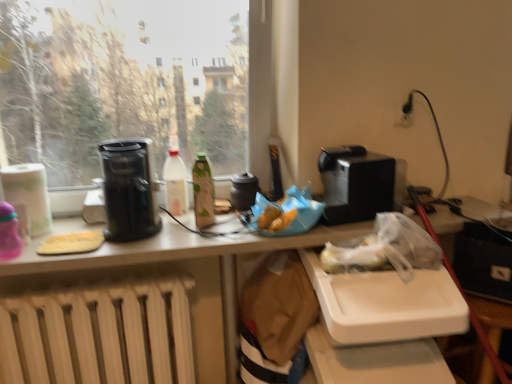
Where is `green matte bottle at center, marked as the 1th bottle in a right-to-left arrangement`? This screenshot has height=384, width=512. green matte bottle at center, marked as the 1th bottle in a right-to-left arrangement is located at coordinates (203, 192).

The height and width of the screenshot is (384, 512). Describe the element at coordinates (129, 189) in the screenshot. I see `black plastic coffee maker at left` at that location.

Image resolution: width=512 pixels, height=384 pixels. What do you see at coordinates (123, 83) in the screenshot? I see `transparent glass window at upper left` at bounding box center [123, 83].

Measure the distance between matte black kettle at center, which is counted as the first appliance, starting from the left, and camera.

matte black kettle at center, which is counted as the first appliance, starting from the left, is 1.59 meters from camera.

The image size is (512, 384). Identify the location of matte black kettle at center, the 2th appliance positioned from the right. (244, 191).

You are a GUI agent. You are given a task and a screenshot of the screen. Output one action in this format:
    pyautogui.click(x=<x>, y=<y>)
    Task: Click on the white matte radiator at lower left
    This screenshot has width=512, height=384.
    Given the screenshot: What is the action you would take?
    pyautogui.click(x=100, y=335)

Where is `yellow sponge at left`? yellow sponge at left is located at coordinates (72, 243).

Who is taller, white matte bottle at center, acting as the 1th bottle starting from the left, or black plastic toaster at upper right, the 1th appliance from the right?

Standing taller between the two is white matte bottle at center, acting as the 1th bottle starting from the left.

From the image's perspective, between white matte bottle at center, arranged as the 2th bottle when viewed from the right, and black plastic toaster at upper right, the 1th appliance from the right, which one is located above?

black plastic toaster at upper right, the 1th appliance from the right, is shown above in the image.

Is white matte bottle at center, acting as the 1th bottle starting from the left, oriented away from black plastic toaster at upper right, which appears as the second appliance when viewed from the left?

No, black plastic toaster at upper right, which appears as the second appliance when viewed from the left, is not at the back of white matte bottle at center, acting as the 1th bottle starting from the left.

How different are the orientations of white matte bottle at center, arranged as the 2th bottle when viewed from the right, and black plastic toaster at upper right, which appears as the second appliance when viewed from the left, in degrees?

0.345 degrees separate the facing orientations of white matte bottle at center, arranged as the 2th bottle when viewed from the right, and black plastic toaster at upper right, which appears as the second appliance when viewed from the left.

Is point (351, 199) closer or farther from the camera than point (178, 178)?

Point (351, 199).

Can you confirm if black plastic toaster at upper right, which appears as the second appliance when viewed from the left, is thinner than white matte bottle at center, acting as the 1th bottle starting from the left?

Incorrect, the width of black plastic toaster at upper right, which appears as the second appliance when viewed from the left, is not less than that of white matte bottle at center, acting as the 1th bottle starting from the left.

Does black plastic toaster at upper right, which appears as the second appliance when viewed from the left, have a lesser height compared to white matte bottle at center, arranged as the 2th bottle when viewed from the right?

Yes, black plastic toaster at upper right, which appears as the second appliance when viewed from the left, is shorter than white matte bottle at center, arranged as the 2th bottle when viewed from the right.

Between matte black kettle at center, the 2th appliance positioned from the right, and yellow sponge at left, which one has larger size?

matte black kettle at center, the 2th appliance positioned from the right.

From a real-world perspective, is matte black kettle at center, the 2th appliance positioned from the right, physically located above or below yellow sponge at left?

Clearly, from a real-world perspective, matte black kettle at center, the 2th appliance positioned from the right, is above yellow sponge at left.

Considering the sizes of matte black kettle at center, which is counted as the first appliance, starting from the left, and yellow sponge at left in the image, is matte black kettle at center, which is counted as the first appliance, starting from the left, taller or shorter than yellow sponge at left?

matte black kettle at center, which is counted as the first appliance, starting from the left, is taller than yellow sponge at left.

Could you tell me if matte black kettle at center, the 2th appliance positioned from the right, is facing white matte radiator at lower left?

No, matte black kettle at center, the 2th appliance positioned from the right, is not oriented towards white matte radiator at lower left.

Which is more to the left, matte black kettle at center, the 2th appliance positioned from the right, or white matte radiator at lower left?

From the viewer's perspective, white matte radiator at lower left appears more on the left side.

Is there a large distance between matte black kettle at center, which is counted as the first appliance, starting from the left, and white matte radiator at lower left?

No, there isn't a large distance between matte black kettle at center, which is counted as the first appliance, starting from the left, and white matte radiator at lower left.

Is white matte radiator at lower left aimed at yellow sponge at left?

No, white matte radiator at lower left is not turned towards yellow sponge at left.

Considering the points (27, 355) and (61, 236), which point is behind, point (27, 355) or point (61, 236)?

Positioned behind is point (27, 355).

Can you tell me how much white matte radiator at lower left and yellow sponge at left differ in facing direction?

The facing directions of white matte radiator at lower left and yellow sponge at left are 2.18 degrees apart.

How different are the orientations of white matte bottle at center, arranged as the 2th bottle when viewed from the right, and white matte radiator at lower left in degrees?

3.36 degrees separate the facing orientations of white matte bottle at center, arranged as the 2th bottle when viewed from the right, and white matte radiator at lower left.

From the image's perspective, is white matte bottle at center, acting as the 1th bottle starting from the left, located above or below white matte radiator at lower left?

From the image's perspective, white matte bottle at center, acting as the 1th bottle starting from the left, appears above white matte radiator at lower left.

Do you think white matte bottle at center, arranged as the 2th bottle when viewed from the right, is within white matte radiator at lower left, or outside of it?

The correct answer is: outside.

Is white matte bottle at center, acting as the 1th bottle starting from the left, positioned with its back to white matte radiator at lower left?

No, white matte bottle at center, acting as the 1th bottle starting from the left, is not facing the opposite direction of white matte radiator at lower left.

Between transparent glass window at upper left and green matte bottle at center, marked as the 1th bottle in a right-to-left arrangement, which one has smaller width?

With smaller width is green matte bottle at center, marked as the 1th bottle in a right-to-left arrangement.

Considering the sizes of objects transparent glass window at upper left and green matte bottle at center, marked as the 1th bottle in a right-to-left arrangement, in the image provided, who is taller, transparent glass window at upper left or green matte bottle at center, marked as the 1th bottle in a right-to-left arrangement,?

transparent glass window at upper left is taller.

Choose the correct answer: Is transparent glass window at upper left inside green matte bottle at center, which appears as the second bottle when viewed from the left, or outside it?

transparent glass window at upper left cannot be found inside green matte bottle at center, which appears as the second bottle when viewed from the left.

From a real-world perspective, is transparent glass window at upper left positioned under green matte bottle at center, which appears as the second bottle when viewed from the left, based on gravity?

No, from a real-world perspective, transparent glass window at upper left is not beneath green matte bottle at center, which appears as the second bottle when viewed from the left.

What are the coordinates of `the 2nd bottle to the left of the black plastic toaster at upper right, which appears as the second appliance when viewed from the left, counting from the anchor's position` in the screenshot? It's located at (175, 184).

Locate an element on the screen. appliance in front of the white matte bottle at center, arranged as the 2th bottle when viewed from the right is located at coordinates (355, 184).

Considering their positions, is transparent glass window at upper left positioned closer to black plastic toaster at upper right, the 1th appliance from the right, than white matte radiator at lower left?

Based on the image, white matte radiator at lower left appears to be nearer to black plastic toaster at upper right, the 1th appliance from the right.

Which object lies nearer to the anchor point matte black kettle at center, the 2th appliance positioned from the right, green matte bottle at center, which appears as the second bottle when viewed from the left, or white matte radiator at lower left?

green matte bottle at center, which appears as the second bottle when viewed from the left.

Looking at the image, which one is located closer to black plastic coffee maker at left, white matte bottle at center, acting as the 1th bottle starting from the left, or white matte radiator at lower left?

white matte bottle at center, acting as the 1th bottle starting from the left, is closer to black plastic coffee maker at left.

From the image, which object appears to be nearer to matte black kettle at center, which is counted as the first appliance, starting from the left, white matte radiator at lower left or yellow sponge at left?

Based on the image, yellow sponge at left appears to be nearer to matte black kettle at center, which is counted as the first appliance, starting from the left.

Which object lies further to the anchor point black plastic coffee maker at left, matte black kettle at center, which is counted as the first appliance, starting from the left, or black plastic toaster at upper right, the 1th appliance from the right?

Based on the image, black plastic toaster at upper right, the 1th appliance from the right, appears to be further to black plastic coffee maker at left.

In the scene shown: Considering their positions, is green matte bottle at center, which appears as the second bottle when viewed from the left, positioned further to transparent glass window at upper left than white matte radiator at lower left?

white matte radiator at lower left.

Looking at the image, which one is located further to green matte bottle at center, which appears as the second bottle when viewed from the left, white matte radiator at lower left or black plastic toaster at upper right, the 1th appliance from the right?

The object further to green matte bottle at center, which appears as the second bottle when viewed from the left, is black plastic toaster at upper right, the 1th appliance from the right.

Based on the photo, considering their positions, is white matte bottle at center, arranged as the 2th bottle when viewed from the right, positioned further to black plastic toaster at upper right, which appears as the second appliance when viewed from the left, than matte black kettle at center, which is counted as the first appliance, starting from the left?

white matte bottle at center, arranged as the 2th bottle when viewed from the right, is positioned further to the anchor black plastic toaster at upper right, which appears as the second appliance when viewed from the left.

Identify the location of kitchen appliance situated between white matte radiator at lower left and black plastic toaster at upper right, which appears as the second appliance when viewed from the left, from left to right. (129, 189).

Where is `food between black plastic coffee maker at left and white matte radiator at lower left in the up-down direction`? The height and width of the screenshot is (384, 512). food between black plastic coffee maker at left and white matte radiator at lower left in the up-down direction is located at coordinates (72, 243).

Where is `kitchen appliance that lies between transparent glass window at upper left and white matte radiator at lower left from top to bottom`? The image size is (512, 384). kitchen appliance that lies between transparent glass window at upper left and white matte radiator at lower left from top to bottom is located at coordinates (129, 189).

Locate an element on the screen. The width and height of the screenshot is (512, 384). appliance between green matte bottle at center, which appears as the second bottle when viewed from the left, and white matte radiator at lower left from top to bottom is located at coordinates (244, 191).